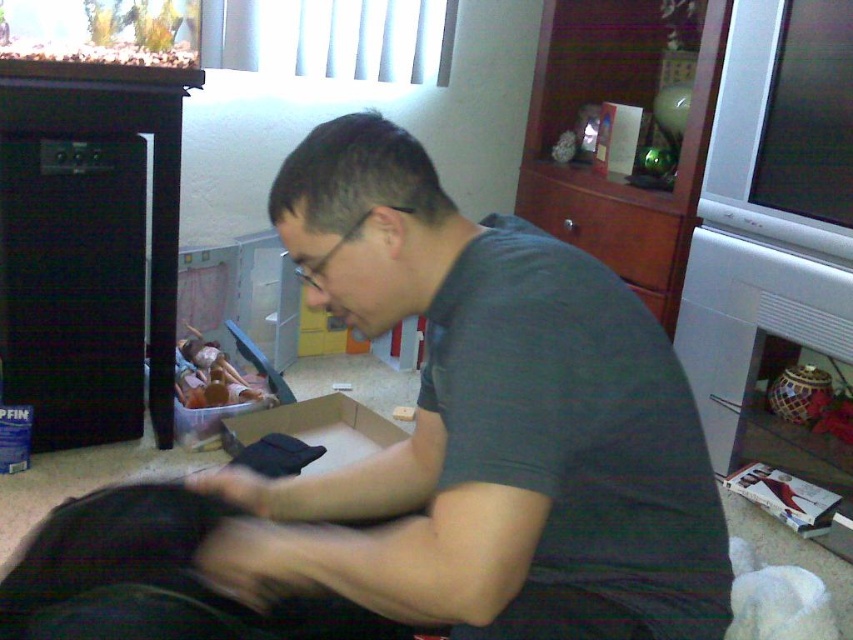
You are standing at the point labeled as point (68, 534) and want to move towards the point labeled as point (349, 129). Which direction should you face to walk towards it?

You should face towards the direction of point (349, 129) since it is in front of point (68, 534).